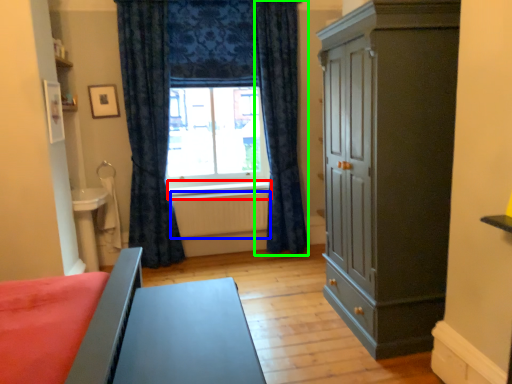
Question: Based on their relative distances, which object is nearer to window sill (highlighted by a red box)? Choose from radiator (highlighted by a blue box) and curtain (highlighted by a green box).

Choices:
 (A) radiator
 (B) curtain

Answer: (A)